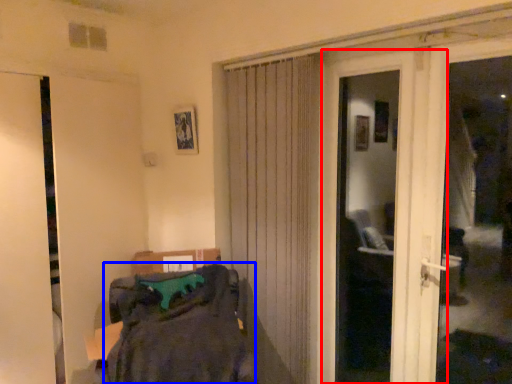
Question: Which point is closer to the camera, door (highlighted by a red box) or laundry (highlighted by a blue box)?

Choices:
 (A) door
 (B) laundry

Answer: (B)